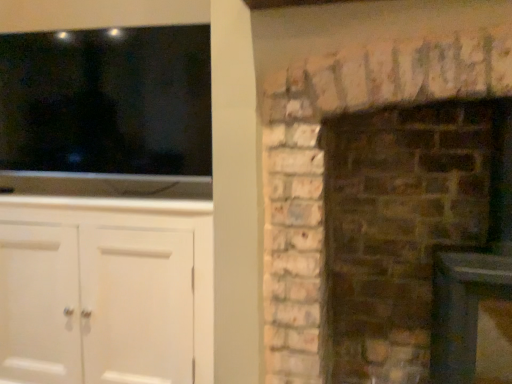
Question: Does brown brick fireplace at right have a lesser height compared to white painted wood cabinet at left?

Choices:
 (A) no
 (B) yes

Answer: (A)

Question: From the image's perspective, is brown brick fireplace at right under white painted wood cabinet at left?

Choices:
 (A) yes
 (B) no

Answer: (B)

Question: Can you confirm if brown brick fireplace at right is taller than white painted wood cabinet at left?

Choices:
 (A) yes
 (B) no

Answer: (A)

Question: Does brown brick fireplace at right appear on the right side of white painted wood cabinet at left?

Choices:
 (A) yes
 (B) no

Answer: (A)

Question: Is brown brick fireplace at right far away from white painted wood cabinet at left?

Choices:
 (A) yes
 (B) no

Answer: (B)

Question: From the image's perspective, is white painted wood cabinet at left above or below black glossy tv at upper left?

Choices:
 (A) above
 (B) below

Answer: (B)

Question: Which is correct: white painted wood cabinet at left is inside black glossy tv at upper left, or outside of it?

Choices:
 (A) outside
 (B) inside

Answer: (A)

Question: Considering the positions of point (138, 256) and point (140, 168), is point (138, 256) closer or farther from the camera than point (140, 168)?

Choices:
 (A) closer
 (B) farther

Answer: (A)

Question: From a real-world perspective, is white painted wood cabinet at left positioned above or below black glossy tv at upper left?

Choices:
 (A) below
 (B) above

Answer: (A)

Question: In terms of height, does black glossy tv at upper left look taller or shorter compared to brown brick fireplace at right?

Choices:
 (A) short
 (B) tall

Answer: (A)

Question: Is black glossy tv at upper left inside or outside of brown brick fireplace at right?

Choices:
 (A) outside
 (B) inside

Answer: (A)

Question: Is point pyautogui.click(x=37, y=158) closer or farther from the camera than point pyautogui.click(x=458, y=314)?

Choices:
 (A) closer
 (B) farther

Answer: (B)

Question: Is black glossy tv at upper left to the left or to the right of brown brick fireplace at right in the image?

Choices:
 (A) left
 (B) right

Answer: (A)

Question: Based on their sizes in the image, would you say black glossy tv at upper left is bigger or smaller than white painted wood cabinet at left?

Choices:
 (A) small
 (B) big

Answer: (A)

Question: Considering the positions of black glossy tv at upper left and white painted wood cabinet at left in the image, is black glossy tv at upper left taller or shorter than white painted wood cabinet at left?

Choices:
 (A) tall
 (B) short

Answer: (B)